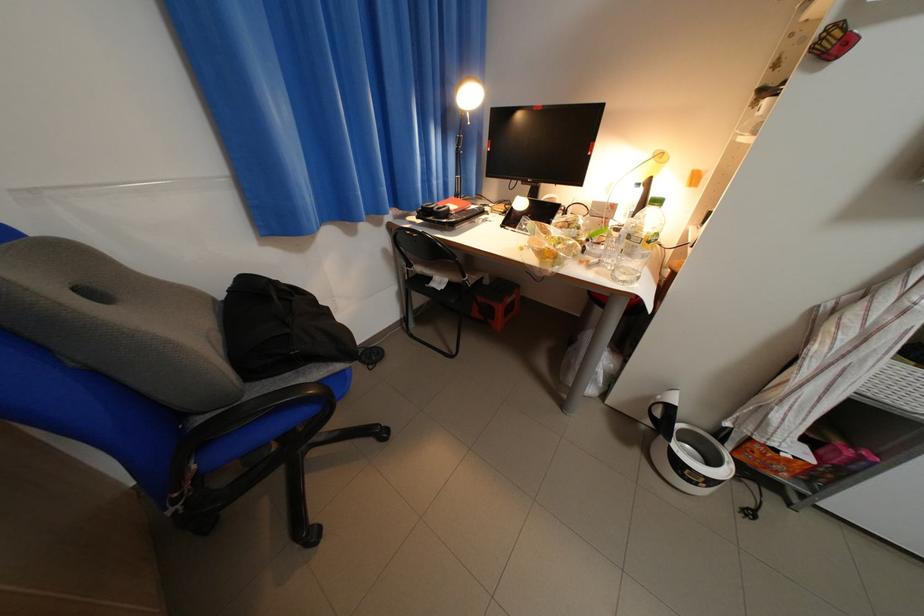
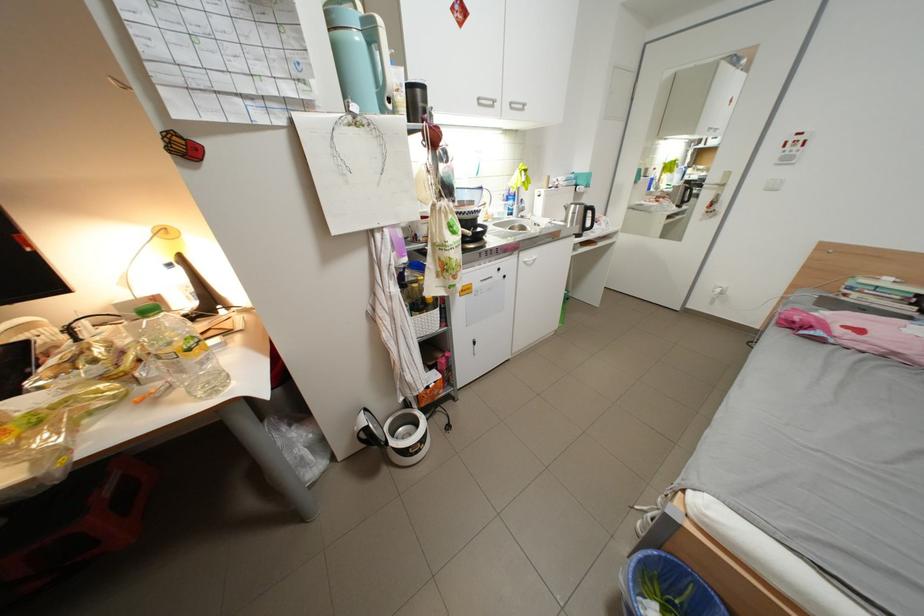
Question: Based on the continuous images, in which direction is the camera rotating? Reply with the corresponding letter.

Choices:
 (A) Left
 (B) Right
 (C) Up
 (D) Down

Answer: (B)